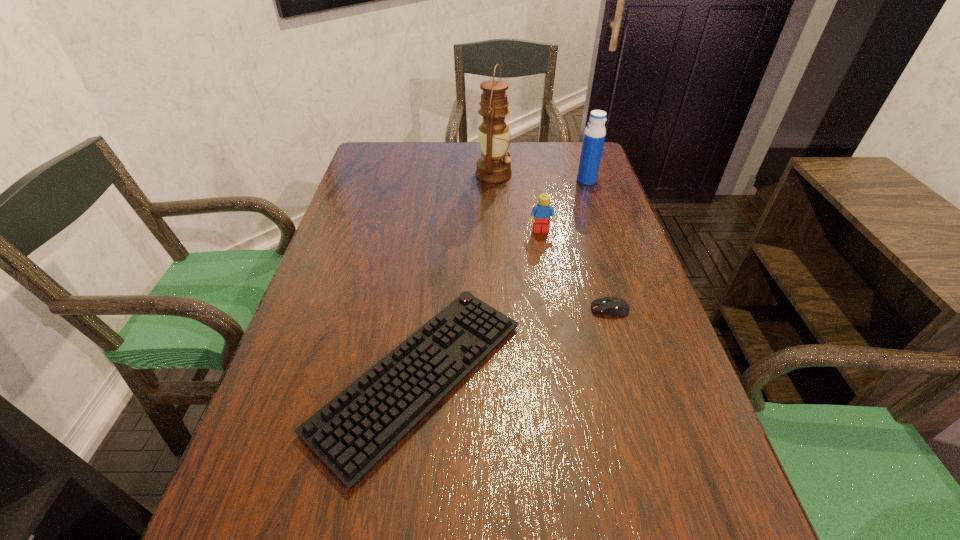
The height and width of the screenshot is (540, 960). I want to click on oil lamp, so click(x=495, y=166).

The width and height of the screenshot is (960, 540). I want to click on water bottle, so click(x=594, y=136).

Identify the location of the third nearest object. This screenshot has height=540, width=960. (541, 213).

This screenshot has width=960, height=540. In order to click on Lego in this screenshot , I will do `click(541, 213)`.

The height and width of the screenshot is (540, 960). What are the coordinates of `computer keyboard` in the screenshot? It's located at (352, 433).

The image size is (960, 540). What are the coordinates of `computer equipment` in the screenshot? It's located at (614, 306).

Find the location of a particular element. This screenshot has width=960, height=540. vacant space situated on the right of the oil lamp is located at coordinates (547, 174).

Where is `vacant region located on the back of the water bottle`? This screenshot has width=960, height=540. vacant region located on the back of the water bottle is located at coordinates (581, 163).

Where is `free location located on the face of the third shortest object`? The height and width of the screenshot is (540, 960). free location located on the face of the third shortest object is located at coordinates (562, 353).

The height and width of the screenshot is (540, 960). In order to click on free space located 0.250m on the right of the computer keyboard in this screenshot , I will do `click(657, 377)`.